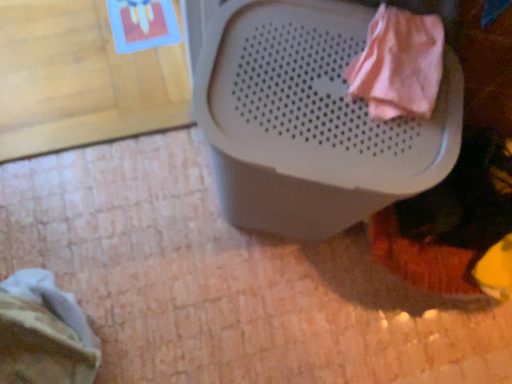
Question: From the image's perspective, would you say white plastic waste container at upper center is shown under pink fabric at upper right, the 2th clothing positioned from the back?

Choices:
 (A) yes
 (B) no

Answer: (A)

Question: From the image's perspective, is white plastic waste container at upper center on pink fabric at upper right, the 2th clothing when ordered from bottom to top?

Choices:
 (A) no
 (B) yes

Answer: (A)

Question: Does white plastic waste container at upper center have a lesser width compared to pink fabric at upper right, which appears as the 1th clothing when viewed from the right?

Choices:
 (A) no
 (B) yes

Answer: (A)

Question: From a real-world perspective, is white plastic waste container at upper center positioned over pink fabric at upper right, the 2th clothing positioned from the back, based on gravity?

Choices:
 (A) no
 (B) yes

Answer: (A)

Question: Considering the relative sizes of white plastic waste container at upper center and pink fabric at upper right, which appears as the 1th clothing when viewed from the right, in the image provided, is white plastic waste container at upper center taller than pink fabric at upper right, which appears as the 1th clothing when viewed from the right,?

Choices:
 (A) yes
 (B) no

Answer: (A)

Question: Is striped fabric at lower left, positioned as the 2th clothing in top-to-bottom order, wider or thinner than white plastic waste container at upper center?

Choices:
 (A) wide
 (B) thin

Answer: (B)

Question: In the image, is striped fabric at lower left, the first clothing ordered from the bottom, positioned in front of or behind white plastic waste container at upper center?

Choices:
 (A) behind
 (B) front

Answer: (A)

Question: From the image's perspective, is striped fabric at lower left, marked as the 1th clothing in a back-to-front arrangement, located above or below white plastic waste container at upper center?

Choices:
 (A) above
 (B) below

Answer: (B)

Question: In the image, is striped fabric at lower left, which ranks as the first clothing in left-to-right order, on the left side or the right side of white plastic waste container at upper center?

Choices:
 (A) left
 (B) right

Answer: (A)

Question: In terms of height, does pink fabric at upper right, the 2th clothing when ordered from bottom to top, look taller or shorter compared to white plastic waste container at upper center?

Choices:
 (A) short
 (B) tall

Answer: (A)

Question: From a real-world perspective, relative to white plastic waste container at upper center, is pink fabric at upper right, the 2th clothing when ordered from bottom to top, vertically above or below?

Choices:
 (A) below
 (B) above

Answer: (B)

Question: Would you say pink fabric at upper right, which is the 1th clothing from top to bottom, is inside or outside white plastic waste container at upper center?

Choices:
 (A) inside
 (B) outside

Answer: (B)

Question: Considering the positions of point (395, 87) and point (281, 153), is point (395, 87) closer or farther from the camera than point (281, 153)?

Choices:
 (A) farther
 (B) closer

Answer: (A)

Question: From the image's perspective, is white plastic waste container at upper center located above or below striped fabric at lower left, the first clothing ordered from the bottom?

Choices:
 (A) above
 (B) below

Answer: (A)

Question: Which is correct: white plastic waste container at upper center is inside striped fabric at lower left, marked as the 1th clothing in a back-to-front arrangement, or outside of it?

Choices:
 (A) inside
 (B) outside

Answer: (B)